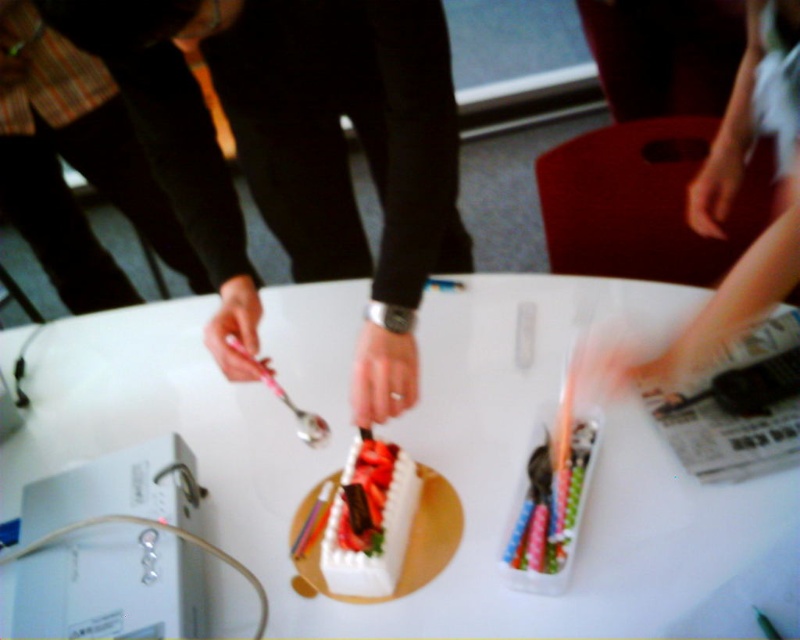
Based on the photo, does white frosted cake at center have a lesser width compared to pink plastic pen at center?

Yes.

Is point (401, 476) behind point (262, 364)?

That is False.

This screenshot has height=640, width=800. What are the coordinates of `white frosted cake at center` in the screenshot? It's located at (381, 544).

Does white frosted cake at center have a lesser height compared to smooth skin hand at upper right?

Correct, white frosted cake at center is not as tall as smooth skin hand at upper right.

What do you see at coordinates (381, 544) in the screenshot? This screenshot has width=800, height=640. I see `white frosted cake at center` at bounding box center [381, 544].

Where is `white frosted cake at center`? The image size is (800, 640). white frosted cake at center is located at coordinates (381, 544).

Image resolution: width=800 pixels, height=640 pixels. In order to click on white frosted cake at center in this screenshot , I will do `click(381, 544)`.

Which is more to the right, matte silver spoon at center or white frosted cake at center?

Positioned to the right is white frosted cake at center.

The image size is (800, 640). What do you see at coordinates (296, 129) in the screenshot? I see `matte silver spoon at center` at bounding box center [296, 129].

This screenshot has height=640, width=800. Identify the location of matte silver spoon at center. (296, 129).